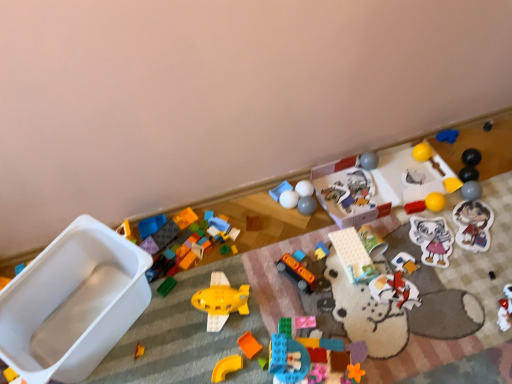
The width and height of the screenshot is (512, 384). I want to click on vacant space that's between white matte figure at center, placed as the seventh toy when sorted from right to left, and orange plastic block at lower left, acting as the 23th toy starting from the right, so click(293, 308).